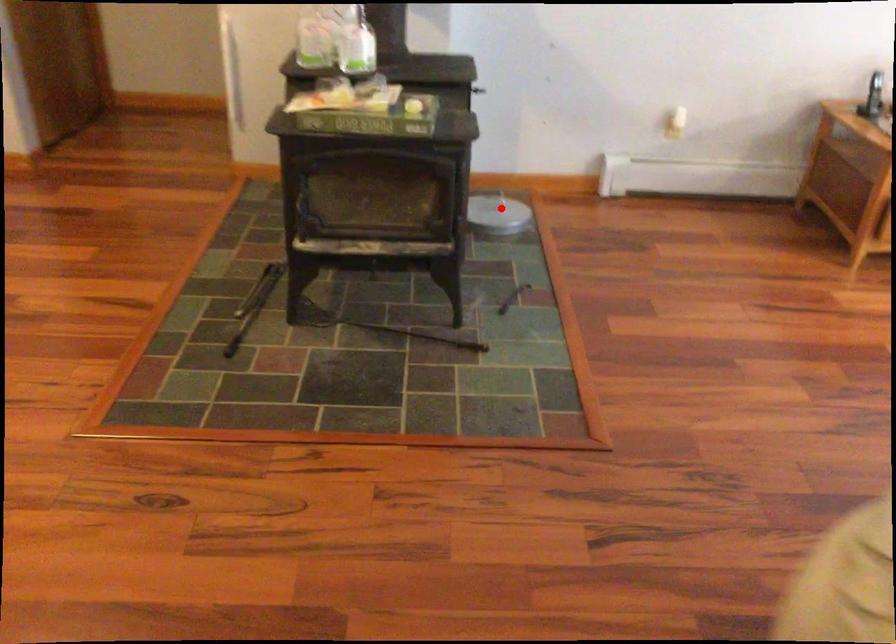
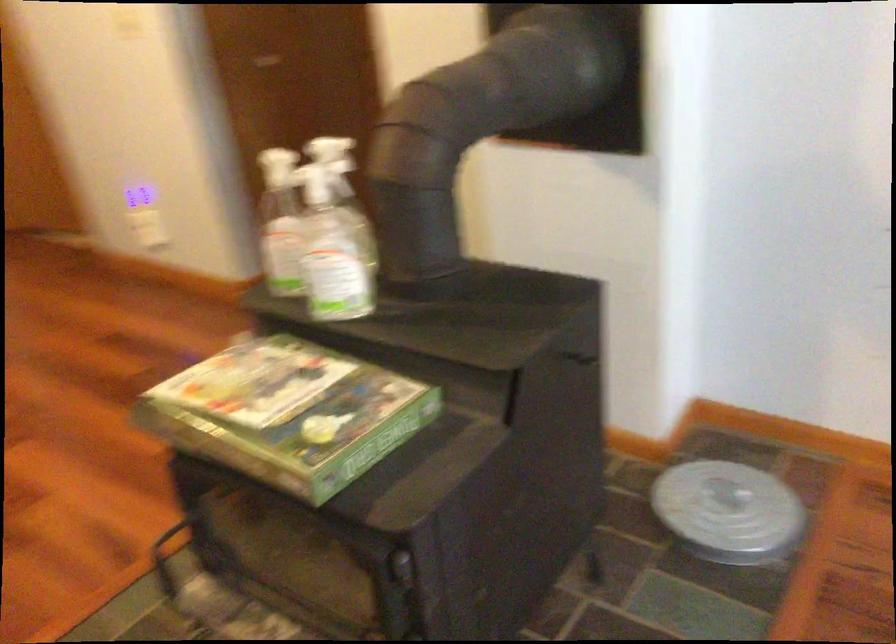
Question: I am providing you with two images of the same scene from different viewpoints. A red point is shown in image1. For the corresponding object point in image2, is it positioned nearer or farther from the camera?

Choices:
 (A) Nearer
 (B) Farther

Answer: (A)